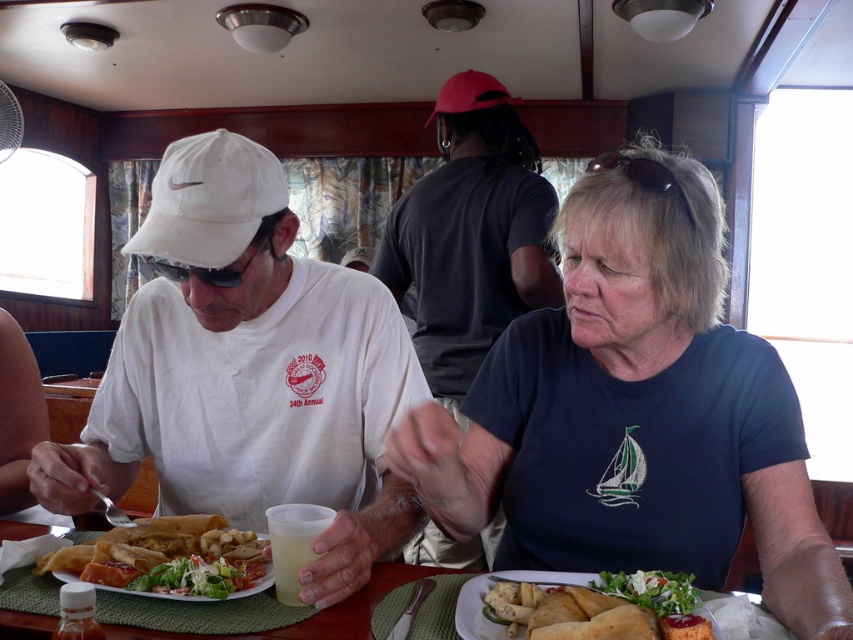
The height and width of the screenshot is (640, 853). Describe the element at coordinates (471, 234) in the screenshot. I see `blue cotton shirt at center` at that location.

The width and height of the screenshot is (853, 640). Describe the element at coordinates (471, 234) in the screenshot. I see `blue cotton shirt at center` at that location.

Find the location of a particular element. blue cotton shirt at center is located at coordinates (471, 234).

You are a GUI agent. You are given a task and a screenshot of the screen. Output one action in this format:
    pyautogui.click(x=<x>, y=<y>)
    Task: Click on the golden crispy bread at center
    This screenshot has width=853, height=640.
    Given the screenshot: What is the action you would take?
    pyautogui.click(x=167, y=557)

Which is below, golden crispy bread at center or golden crispy bread at lower center?

Positioned lower is golden crispy bread at lower center.

Image resolution: width=853 pixels, height=640 pixels. Describe the element at coordinates (167, 557) in the screenshot. I see `golden crispy bread at center` at that location.

Locate an element on the screen. The width and height of the screenshot is (853, 640). golden crispy bread at center is located at coordinates (167, 557).

What do you see at coordinates (247, 372) in the screenshot? The width and height of the screenshot is (853, 640). I see `white matte baseball cap at upper left` at bounding box center [247, 372].

Who is shorter, white matte baseball cap at upper left or blue cotton shirt at center?

white matte baseball cap at upper left

Where is `white matte baseball cap at upper left`? The image size is (853, 640). white matte baseball cap at upper left is located at coordinates (247, 372).